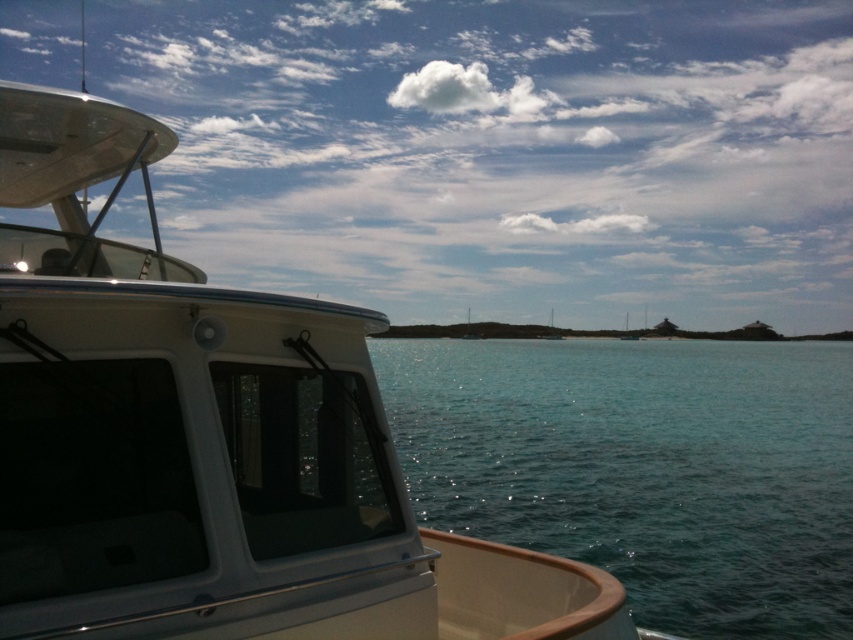
Locate an element on the screen. white glossy boat at left is located at coordinates (503, 152).

Is white glossy boat at left bigger than clear blue water at center?

Indeed, white glossy boat at left has a larger size compared to clear blue water at center.

Identify the location of white glossy boat at left. The image size is (853, 640). (503, 152).